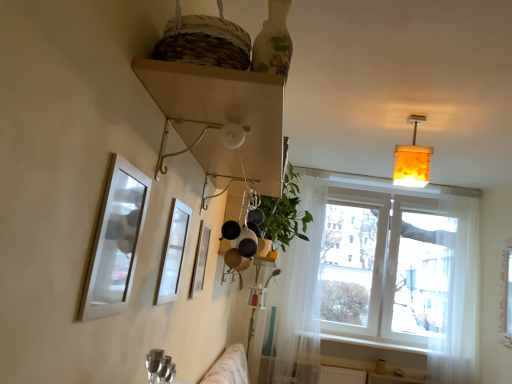
Question: From the image's perspective, would you say translucent white curtain at center, the 1th curtain viewed from the left, is shown under white smooth window sill at lower right?

Choices:
 (A) no
 (B) yes

Answer: (A)

Question: Is white smooth window sill at lower right completely or partially inside translucent white curtain at center, the 1th curtain viewed from the left?

Choices:
 (A) no
 (B) yes

Answer: (A)

Question: Is translucent white curtain at center, the 1th curtain viewed from the left, shorter than white smooth window sill at lower right?

Choices:
 (A) no
 (B) yes

Answer: (A)

Question: Is translucent white curtain at center, the 1th curtain viewed from the left, to the left of white smooth window sill at lower right from the viewer's perspective?

Choices:
 (A) yes
 (B) no

Answer: (A)

Question: Does translucent white curtain at center, the 1th curtain viewed from the left, have a greater height compared to white smooth window sill at lower right?

Choices:
 (A) no
 (B) yes

Answer: (B)

Question: Is translucent white curtain at center, arranged as the 2th curtain when viewed from the right, positioned in front of white smooth window sill at lower right?

Choices:
 (A) yes
 (B) no

Answer: (A)

Question: From a real-world perspective, is metallic silver picture frame at center, the third picture frame from the front, under transparent fabric at right?

Choices:
 (A) yes
 (B) no

Answer: (A)

Question: Is metallic silver picture frame at center, the third picture frame from the front, taller than transparent fabric at right?

Choices:
 (A) yes
 (B) no

Answer: (B)

Question: Is metallic silver picture frame at center, the third picture frame from the front, thinner than transparent fabric at right?

Choices:
 (A) yes
 (B) no

Answer: (A)

Question: Does metallic silver picture frame at center, the third picture frame from the front, appear on the right side of transparent fabric at right?

Choices:
 (A) yes
 (B) no

Answer: (B)

Question: Could you tell me if metallic silver picture frame at center, the 1th picture frame in the back-to-front sequence, is turned towards transparent fabric at right?

Choices:
 (A) yes
 (B) no

Answer: (B)

Question: Does metallic silver picture frame at center, the 1th picture frame in the back-to-front sequence, have a larger size compared to transparent fabric at right?

Choices:
 (A) yes
 (B) no

Answer: (B)

Question: Does metallic silver picture frame at center, the 1th picture frame in the back-to-front sequence, lie behind white glossy picture frame at upper center, acting as the 2th picture frame starting from the front?

Choices:
 (A) yes
 (B) no

Answer: (A)